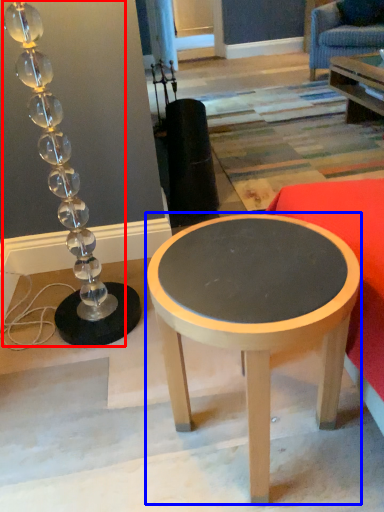
Question: Which object is further to the camera taking this photo, lamp (highlighted by a red box) or coffee table (highlighted by a blue box)?

Choices:
 (A) lamp
 (B) coffee table

Answer: (A)